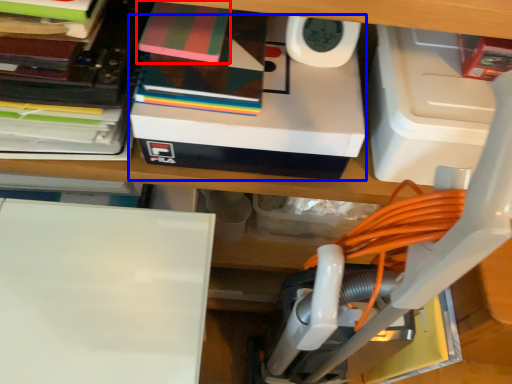
Question: Which of the following is the closest to the observer, paperback book (highlighted by a red box) or box (highlighted by a blue box)?

Choices:
 (A) paperback book
 (B) box

Answer: (B)